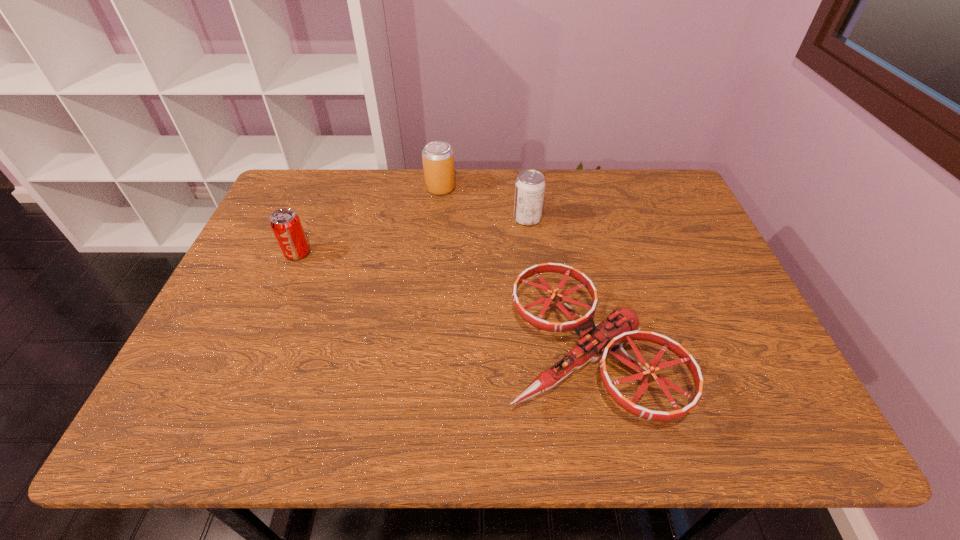
I want to click on vacant point located between the farthest soda can and the leftmost object, so click(369, 221).

The image size is (960, 540). I want to click on free spot between the third object from right to left and the rightmost soda can, so click(x=484, y=204).

Image resolution: width=960 pixels, height=540 pixels. Find the location of `vacant region between the third nearest object and the farthest object`. vacant region between the third nearest object and the farthest object is located at coordinates (484, 204).

Where is `vacant region between the leftmost object and the rightmost soda can`? Image resolution: width=960 pixels, height=540 pixels. vacant region between the leftmost object and the rightmost soda can is located at coordinates (413, 236).

Where is `empty space between the drone and the second object from left to right`? The height and width of the screenshot is (540, 960). empty space between the drone and the second object from left to right is located at coordinates (515, 272).

I want to click on free area in between the second nearest soda can and the leftmost object, so click(413, 236).

Where is `vacant space that's between the farthest soda can and the leftmost object`? This screenshot has height=540, width=960. vacant space that's between the farthest soda can and the leftmost object is located at coordinates (369, 221).

Where is `free point between the second soda can from right to left and the nearest soda can`? free point between the second soda can from right to left and the nearest soda can is located at coordinates (369, 221).

Where is `vacant region between the drone and the leftmost object`? vacant region between the drone and the leftmost object is located at coordinates 443,305.

In order to click on object that stands as the third closest to the third farthest object in this screenshot , I will do click(x=530, y=185).